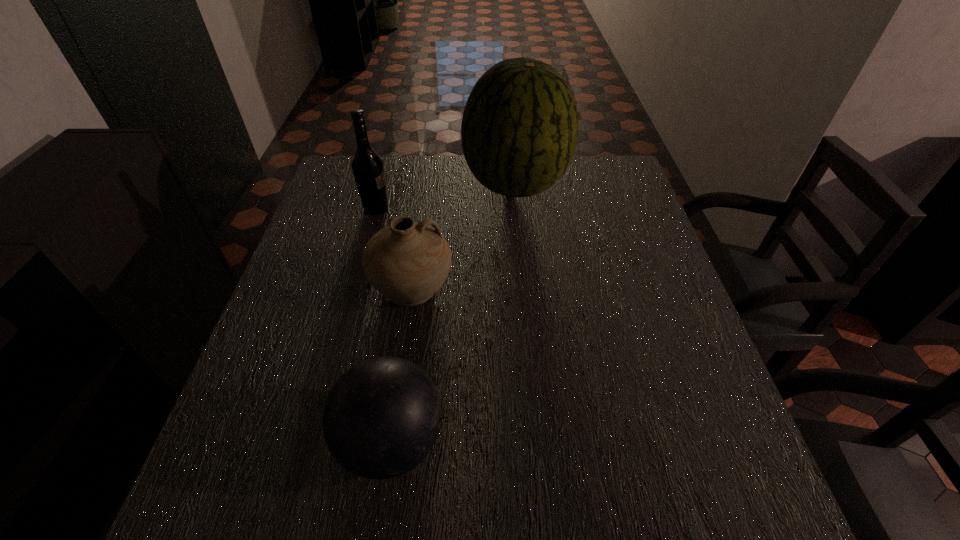
The width and height of the screenshot is (960, 540). I want to click on vacant point located between the wine bottle and the nearest object, so click(x=384, y=325).

Where is `free space between the pottery and the tallest object`? The height and width of the screenshot is (540, 960). free space between the pottery and the tallest object is located at coordinates (464, 236).

Locate an element on the screen. This screenshot has height=540, width=960. free space between the bowling ball and the watermelon is located at coordinates (453, 314).

Where is `vacant space that's between the second tallest object and the rightmost object`? vacant space that's between the second tallest object and the rightmost object is located at coordinates (445, 197).

I want to click on free space between the watermelon and the second nearest object, so click(x=464, y=236).

Where is `vacant point located between the bowling ball and the rightmost object`? The height and width of the screenshot is (540, 960). vacant point located between the bowling ball and the rightmost object is located at coordinates (453, 314).

The height and width of the screenshot is (540, 960). I want to click on free spot between the rightmost object and the pottery, so click(464, 236).

The height and width of the screenshot is (540, 960). In order to click on empty space between the watermelon and the nearest object in this screenshot , I will do `click(453, 314)`.

Choose which object is the third nearest neighbor to the third farthest object. Please provide its 2D coordinates. Your answer should be formatted as a tuple, i.e. [(x, y)], where the tuple contains the x and y coordinates of a point satisfying the conditions above.

[(381, 418)]

Select which object appears as the third closest to the rightmost object. Please provide its 2D coordinates. Your answer should be formatted as a tuple, i.e. [(x, y)], where the tuple contains the x and y coordinates of a point satisfying the conditions above.

[(381, 418)]